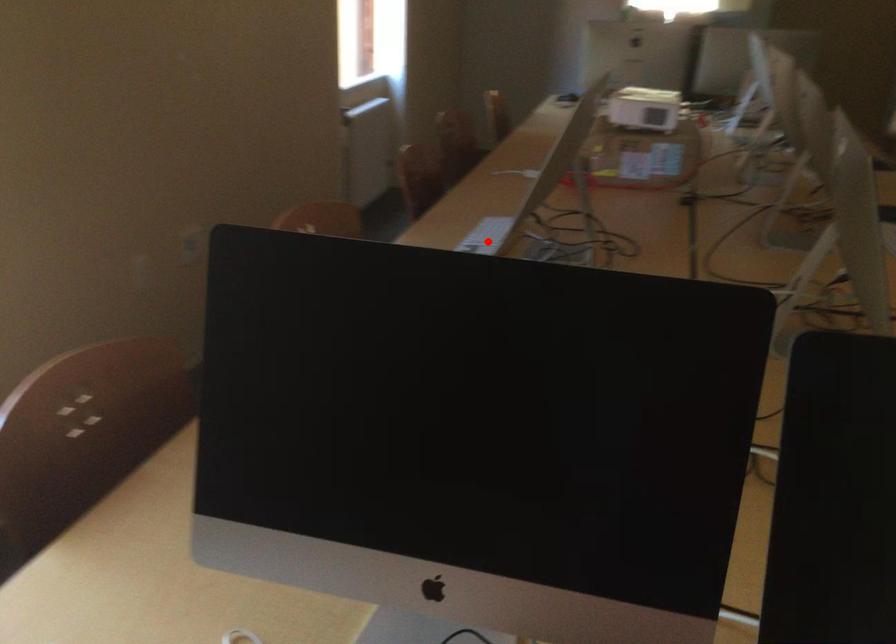
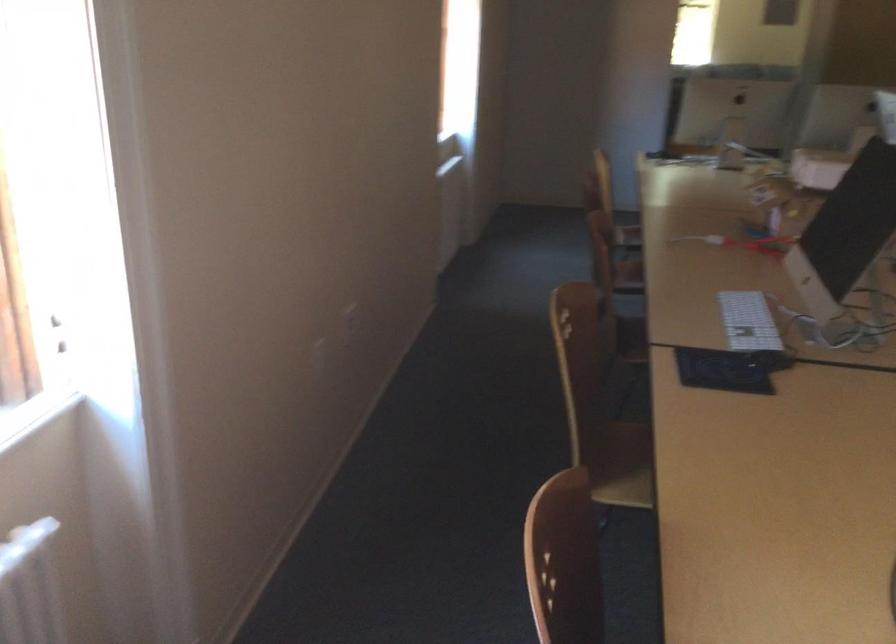
The point at the highlighted location is marked in the first image. Where is the corresponding point in the second image?

(747, 321)